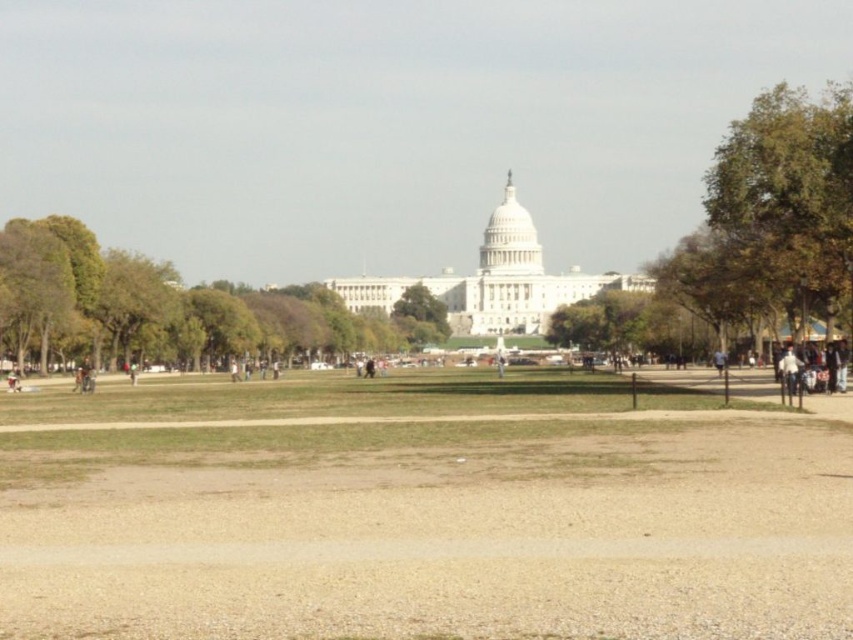
Question: Does green leafy tree at center have a lesser width compared to white matte jacket at lower right?

Choices:
 (A) no
 (B) yes

Answer: (A)

Question: Among these points, which one is farthest from the camera?

Choices:
 (A) (500, 355)
 (B) (788, 387)

Answer: (A)

Question: Which of the following is the farthest from the observer?

Choices:
 (A) (502, 360)
 (B) (415, 484)
 (C) (410, 321)

Answer: (C)

Question: Considering the real-world distances, which object is closest to the green leafy tree at center?

Choices:
 (A) light brown leather jacket at center
 (B) white matte jacket at lower right
 (C) brown gravel park at center
 (D) green leafy tree at left

Answer: (D)

Question: Does green leafy tree at left have a smaller size compared to green leafy tree at center?

Choices:
 (A) yes
 (B) no

Answer: (B)

Question: Is brown gravel park at center below green leafy tree at center?

Choices:
 (A) no
 (B) yes

Answer: (B)